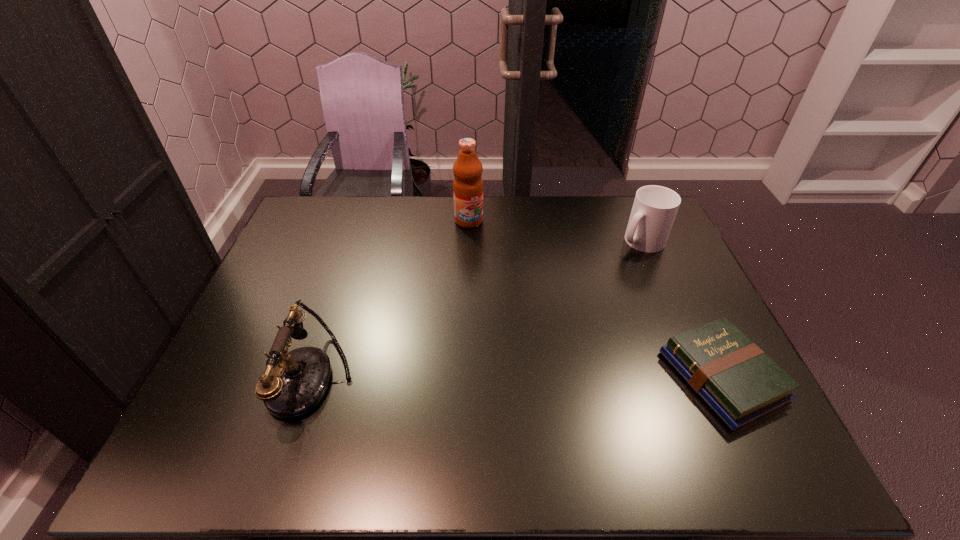
This screenshot has width=960, height=540. In order to click on mug positioned at the right edge in this screenshot , I will do `click(654, 209)`.

Identify the location of object situated at the near left corner. The image size is (960, 540). (293, 385).

Where is `object present at the far right corner`? The image size is (960, 540). object present at the far right corner is located at coordinates (654, 209).

At what (x,y) coordinates should I click in order to perform the action: click on object at the near right corner. Please return your answer as a coordinate pair (x, y). This screenshot has width=960, height=540. Looking at the image, I should click on click(741, 384).

Identify the location of free spot at the far edge of the desktop. The height and width of the screenshot is (540, 960). (591, 211).

Where is `vacant area at the near edge of the desktop`? vacant area at the near edge of the desktop is located at coordinates (355, 401).

In the image, there is a desktop. Identify the location of vacant space at the left edge. (296, 259).

This screenshot has width=960, height=540. What are the coordinates of `vacant space at the far left corner of the desktop` in the screenshot? It's located at (314, 200).

You are a GUI agent. You are given a task and a screenshot of the screen. Output one action in this format:
    pyautogui.click(x=<x>, y=<y>)
    Task: Click on the vacant space in between the shortest object and the mug
    
    Given the screenshot: What is the action you would take?
    pyautogui.click(x=682, y=309)

Locate an element on the screen. free space between the leftmost object and the mug is located at coordinates (477, 309).